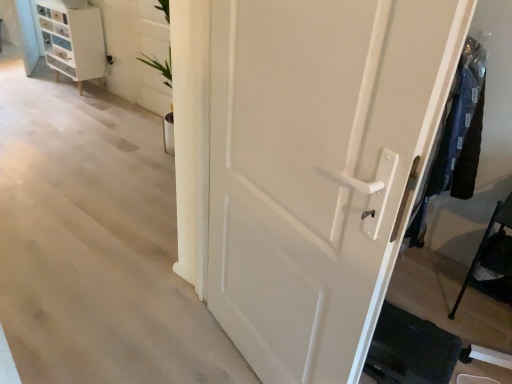
Locate an element on the screen. The width and height of the screenshot is (512, 384). vacant space underneath black metal cane at lower right (from a real-world perspective) is located at coordinates (486, 311).